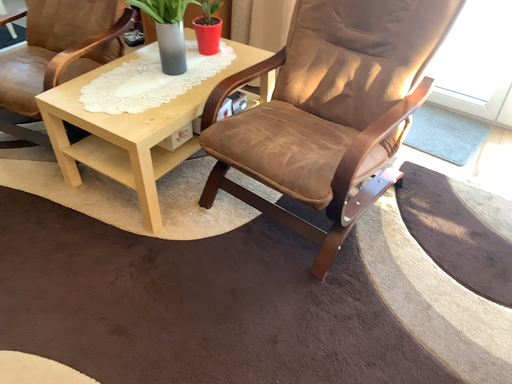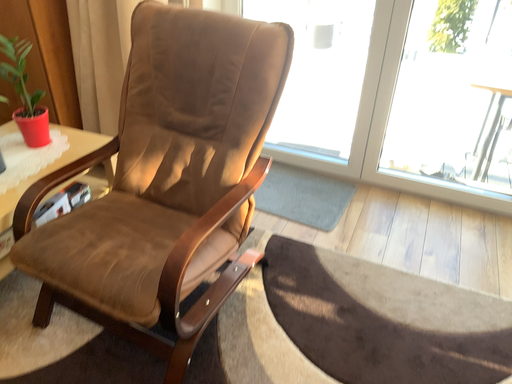
Question: How did the camera likely rotate when shooting the video?

Choices:
 (A) rotated upward
 (B) rotated downward

Answer: (A)